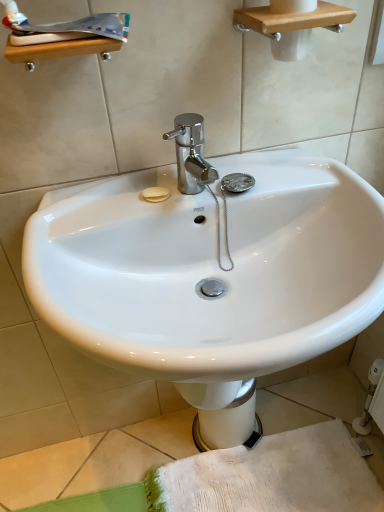
The height and width of the screenshot is (512, 384). I want to click on vacant space underneath white glossy sink at center (from a real-world perspective), so click(x=240, y=475).